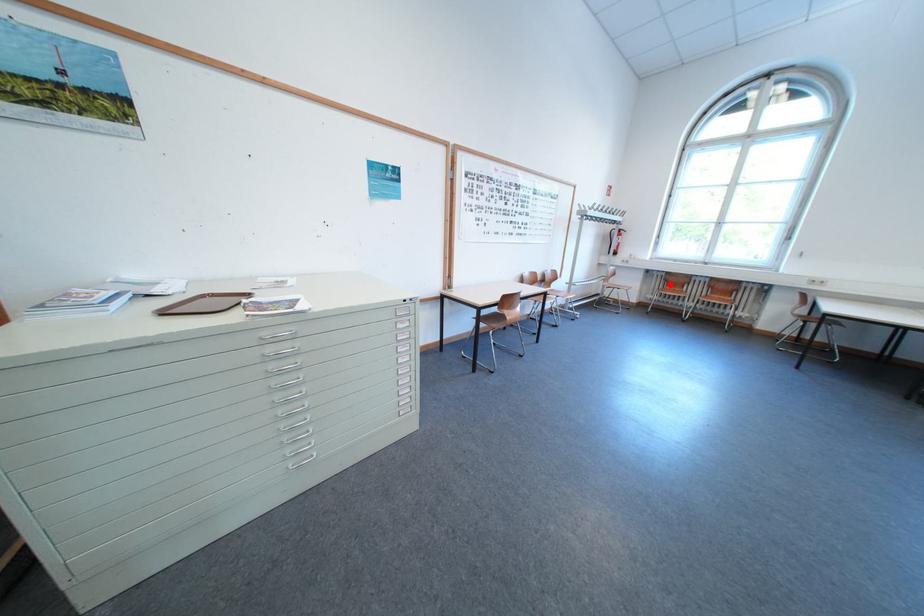
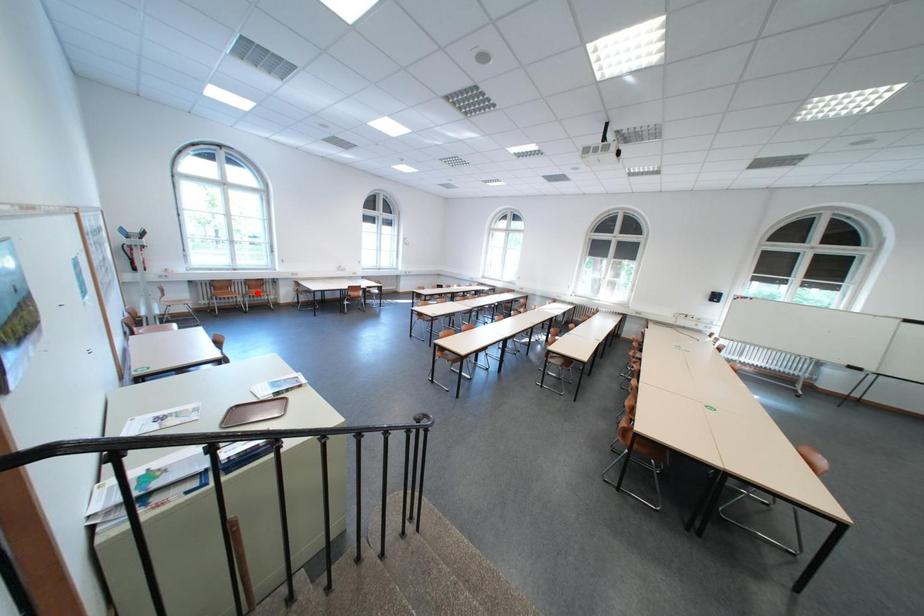
I am providing you with two images of the same scene from different viewpoints. A red point is marked on the first image and another point is marked on the second image. Are the points marked in image1 and image2 representing the same 3D position?

No